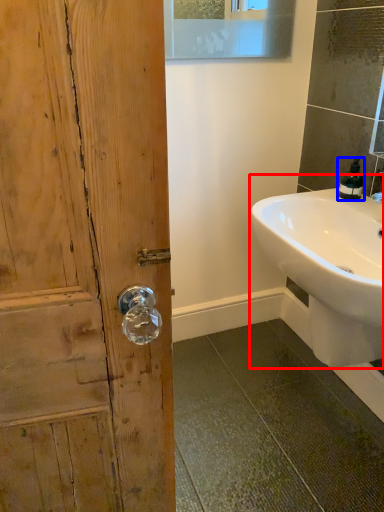
Question: Which point is closer to the camera, sink (highlighted by a red box) or soap dispenser (highlighted by a blue box)?

Choices:
 (A) sink
 (B) soap dispenser

Answer: (A)